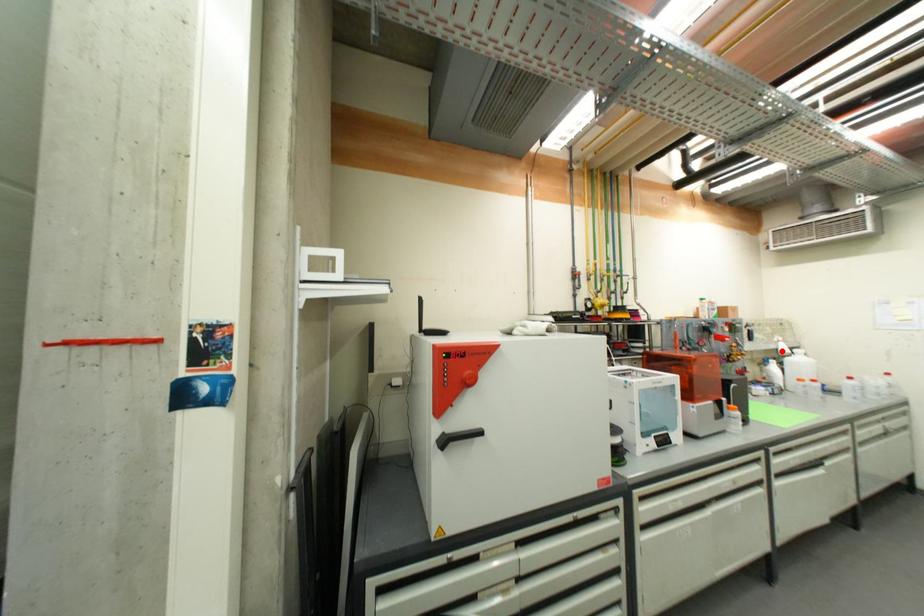
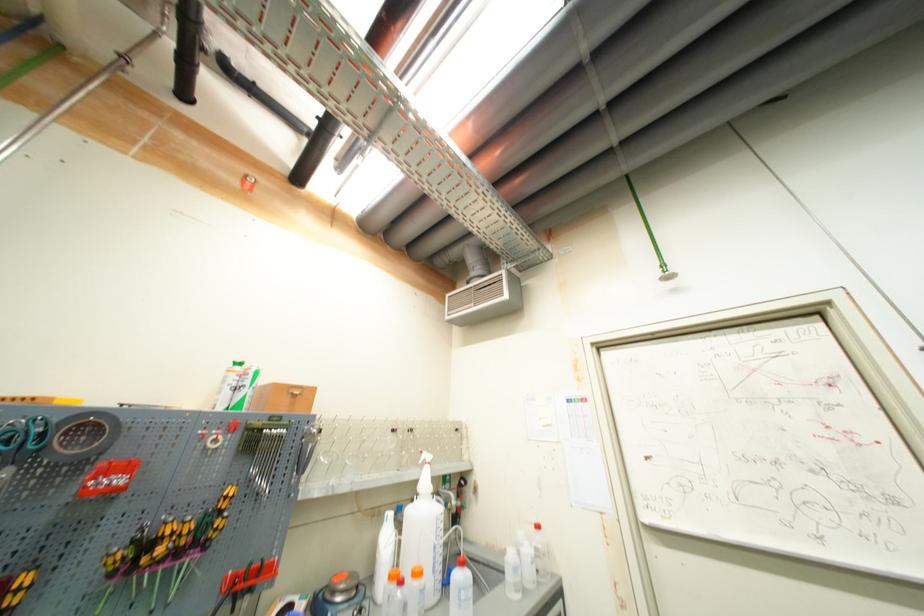
Question: I am providing you with two images of the same scene from different viewpoints. Given a red point in image1, look at the same physical point in image2. Is it:

Choices:
 (A) Closer to the viewpoint
 (B) Farther from the viewpoint

Answer: (B)